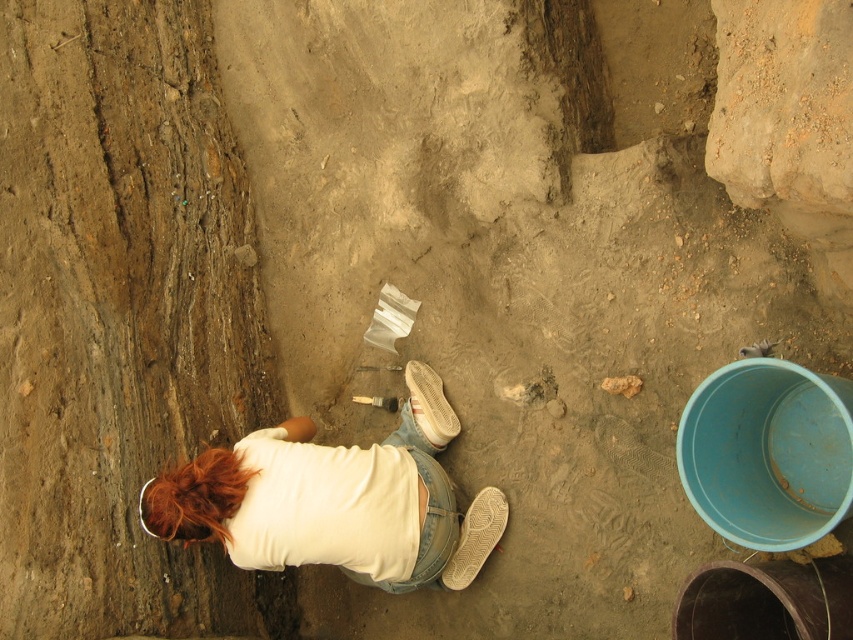
Which of these two, white matte shoe at lower center or white suede shoe at center, stands shorter?

white suede shoe at center is shorter.

Is point (459, 586) farther from camera compared to point (445, 403)?

No, it is in front of (445, 403).

At what (x,y) coordinates should I click in order to perform the action: click on white matte shoe at lower center. Please return your answer as a coordinate pair (x, y). The height and width of the screenshot is (640, 853). Looking at the image, I should click on (476, 538).

Which of these two, white cotton shirt at center or white matte shoe at lower center, stands shorter?

Standing shorter between the two is white matte shoe at lower center.

Who is more forward, (459,564) or (486,554)?

Point (486,554) is more forward.

What are the coordinates of `white cotton shirt at center` in the screenshot? It's located at (337, 500).

Is white cotton shirt at center wider than white suede shoe at center?

Yes, white cotton shirt at center is wider than white suede shoe at center.

Does white cotton shirt at center appear over white suede shoe at center?

Actually, white cotton shirt at center is below white suede shoe at center.

Locate an element on the screen. This screenshot has width=853, height=640. white cotton shirt at center is located at coordinates (337, 500).